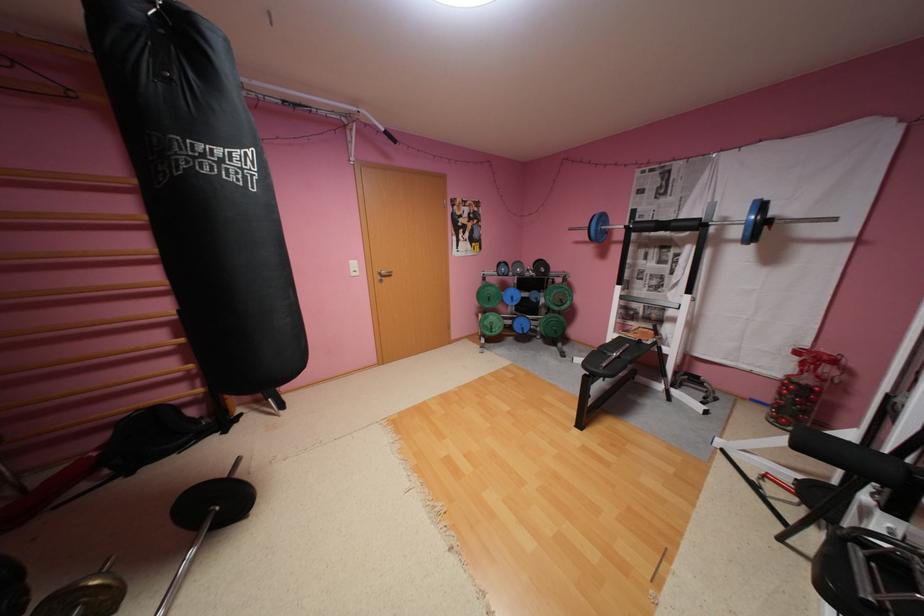
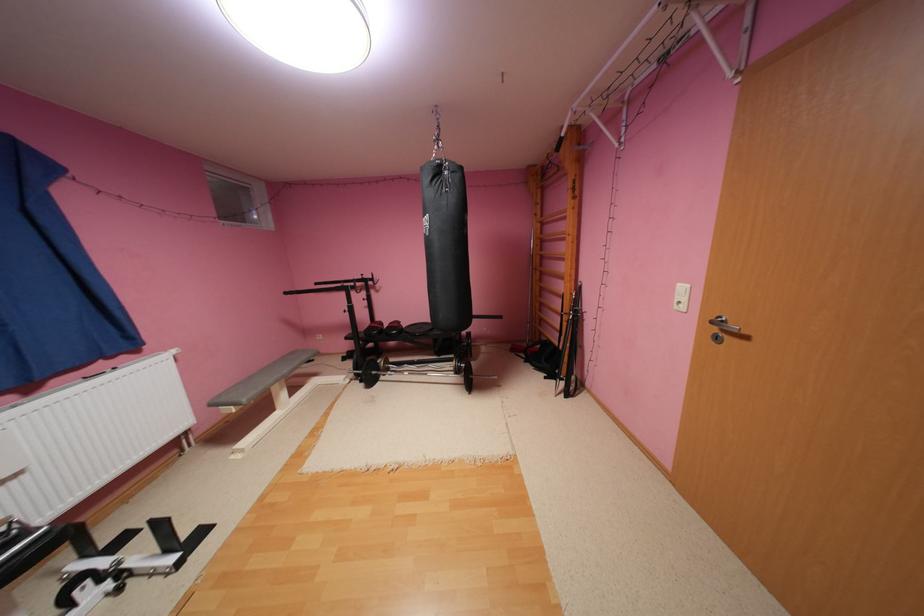
Locate, in the second image, the point that corresponds to (391,276) in the first image.

(733, 330)